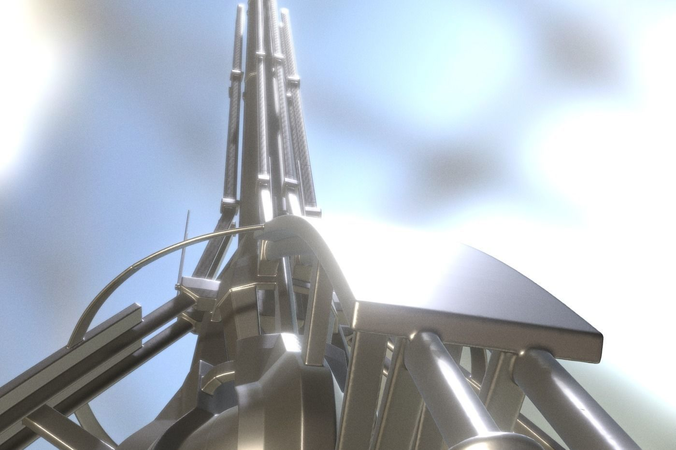
The width and height of the screenshot is (676, 450). I want to click on white light, so point(38,67).